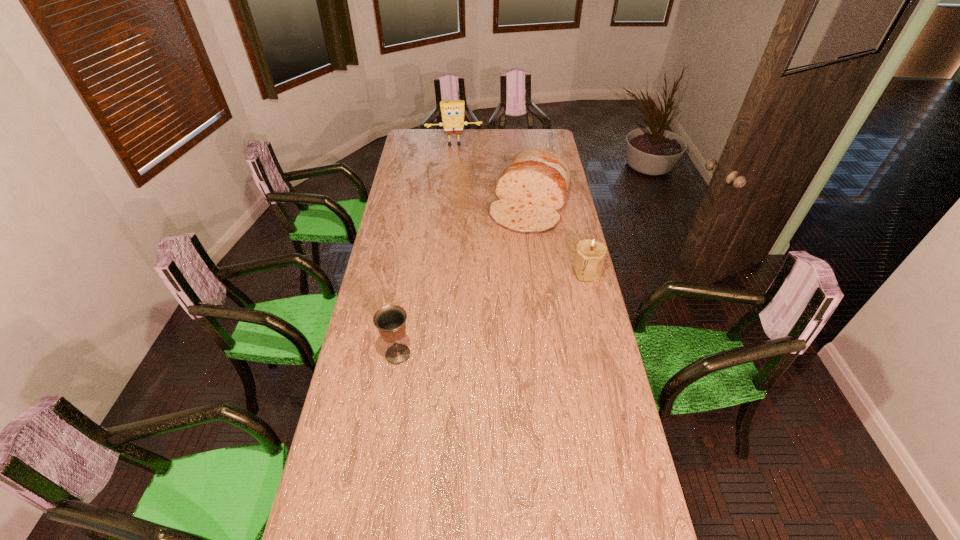
The image size is (960, 540). What are the coordinates of `vacant space at the left edge` in the screenshot? It's located at (403, 259).

In the image, there is a desktop. Where is `vacant space at the right edge`? Image resolution: width=960 pixels, height=540 pixels. vacant space at the right edge is located at coordinates (602, 390).

The width and height of the screenshot is (960, 540). What are the coordinates of `vacant area at the near left corner of the desktop` in the screenshot? It's located at (364, 489).

Identify the location of vacant position at the far right corner of the desktop. (543, 137).

The image size is (960, 540). I want to click on free spot between the chalice and the sponge, so click(x=426, y=249).

The height and width of the screenshot is (540, 960). What are the coordinates of `vacant region between the third farthest object and the chalice` in the screenshot? It's located at (492, 313).

I want to click on vacant space in between the third nearest object and the second nearest object, so click(559, 239).

Locate an element on the screen. The width and height of the screenshot is (960, 540). vacant point located between the bread and the sponge is located at coordinates (492, 176).

The image size is (960, 540). I want to click on blank region between the tallest object and the chalice, so click(x=426, y=249).

The height and width of the screenshot is (540, 960). Identify the location of blank region between the farthest object and the bread. (492, 176).